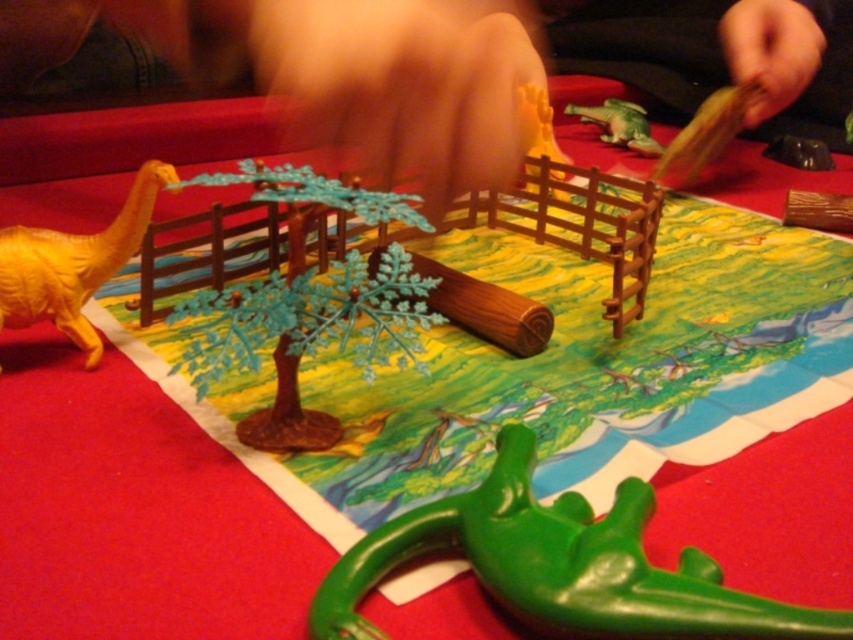
Between point (390, 522) and point (618, 136), which one is positioned behind?

Positioned behind is point (618, 136).

Which is behind, point (328, 628) or point (610, 115)?

The point (610, 115) is behind.

Locate an element on the screen. The image size is (853, 640). green plastic dinosaur at lower center is located at coordinates (561, 566).

From the picture: Measure the distance from green plastic dinosaur at lower center to yellow matte dinosaur at left.

green plastic dinosaur at lower center and yellow matte dinosaur at left are 15.32 inches apart.

Is point (483, 531) positioned before point (136, 218)?

Yes, it is in front of point (136, 218).

The width and height of the screenshot is (853, 640). Find the location of `green plastic dinosaur at lower center`. green plastic dinosaur at lower center is located at coordinates (561, 566).

Is yellow matte dinosaur at left bigger than green plastic crocodile at upper right?

No, yellow matte dinosaur at left is not bigger than green plastic crocodile at upper right.

Between point (100, 244) and point (601, 140), which one is positioned behind?

The point (601, 140) is behind.

Identify the location of yellow matte dinosaur at left. 73,264.